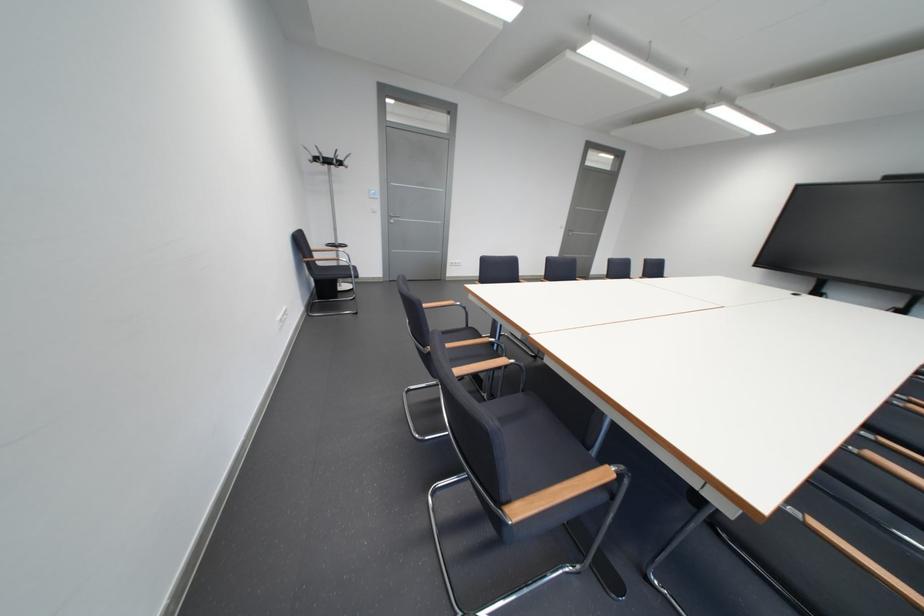
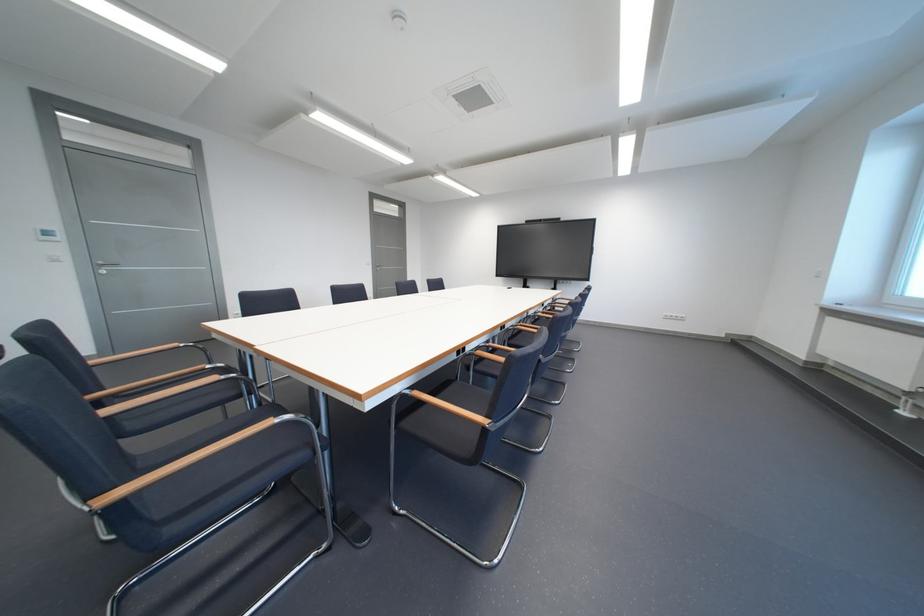
Question: The camera is either moving clockwise (left) or counter-clockwise (right) around the object. The first image is from the beginning of the video and the second image is from the end. Is the camera moving left or right when shooting the video?

Choices:
 (A) Left
 (B) Right

Answer: (A)